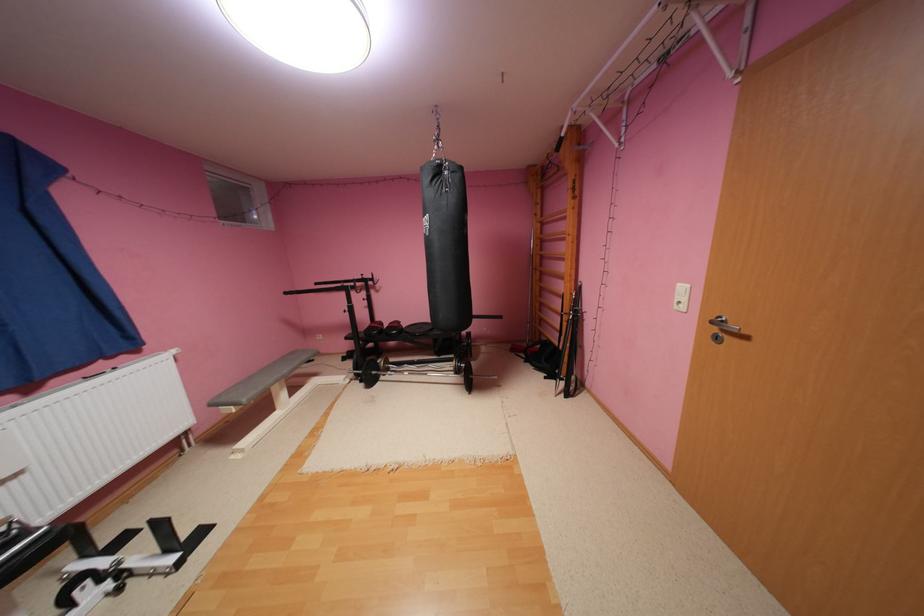
Describe the element at coordinates (446, 345) in the screenshot. I see `the black press handle` at that location.